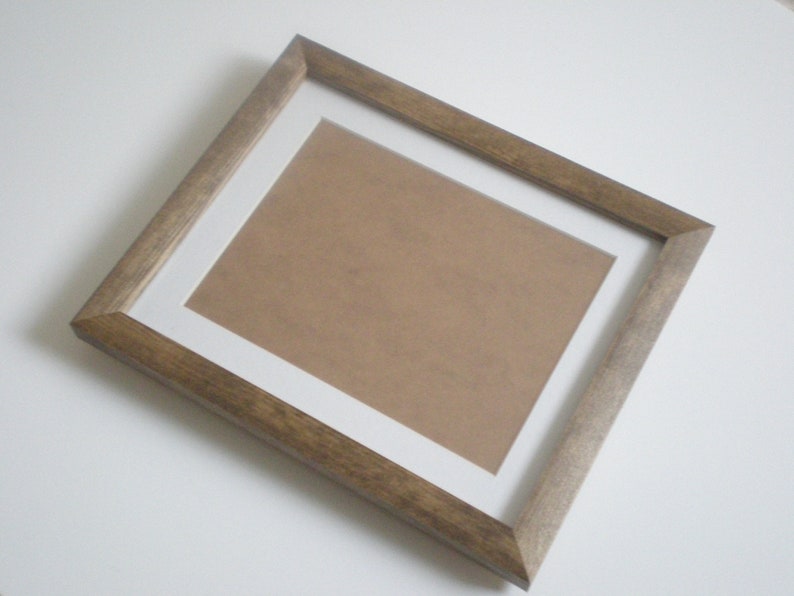
This screenshot has width=794, height=596. Find the location of `corner of frame shadow`. corner of frame shadow is located at coordinates (28, 334), (499, 586), (244, 58).